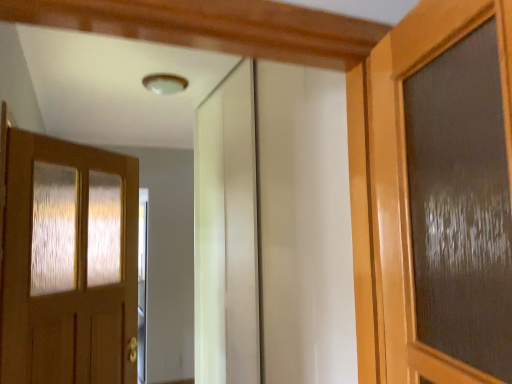
Describe the element at coordinates (69, 263) in the screenshot. I see `matte wood door at left` at that location.

Where is `matte wood door at left`? This screenshot has width=512, height=384. matte wood door at left is located at coordinates (69, 263).

Identify the location of white glossy elevator at center. The width and height of the screenshot is (512, 384). (273, 229).

Describe the element at coordinates (273, 229) in the screenshot. I see `white glossy elevator at center` at that location.

What are the coordinates of `matte wood door at left` in the screenshot? It's located at (69, 263).

Considering the relative positions of matte wood door at left and white glossy elevator at center in the image provided, is matte wood door at left to the left of white glossy elevator at center from the viewer's perspective?

Yes, matte wood door at left is to the left of white glossy elevator at center.

Is matte wood door at left closer to camera compared to white glossy elevator at center?

No, matte wood door at left is behind white glossy elevator at center.

Does point (75, 355) lie behind point (201, 275)?

No, it is not.

From the image's perspective, is matte wood door at left located beneath white glossy elevator at center?

Correct, matte wood door at left appears lower than white glossy elevator at center in the image.

From a real-world perspective, is matte wood door at left beneath white glossy elevator at center?

Yes, from a real-world perspective, matte wood door at left is below white glossy elevator at center.

Between matte wood door at left and white glossy elevator at center, which one has larger width?

white glossy elevator at center is wider.

Considering the sizes of objects matte wood door at left and white glossy elevator at center in the image provided, who is shorter, matte wood door at left or white glossy elevator at center?

Standing shorter between the two is matte wood door at left.

Considering the relative sizes of matte wood door at left and white glossy elevator at center in the image provided, is matte wood door at left bigger than white glossy elevator at center?

No.

Is matte wood door at left inside or outside of white glossy elevator at center?

matte wood door at left is located beyond the bounds of white glossy elevator at center.

Is matte wood door at left next to white glossy elevator at center and touching it?

No, matte wood door at left is not making contact with white glossy elevator at center.

Is matte wood door at left positioned with its back to white glossy elevator at center?

That's not correct — matte wood door at left is not looking away from white glossy elevator at center.

You are a GUI agent. You are given a task and a screenshot of the screen. Output one action in this format:
    pyautogui.click(x=<x>, y=<y>)
    Task: Click on the elevator above the matte wood door at left (from the image's perspective)
    This screenshot has width=512, height=384.
    Given the screenshot: What is the action you would take?
    pyautogui.click(x=273, y=229)

Considering the relative positions of white glossy elevator at center and matte wood door at left in the image provided, is white glossy elevator at center to the right of matte wood door at left from the viewer's perspective?

Yes, white glossy elevator at center is to the right of matte wood door at left.

Relative to matte wood door at left, is white glossy elevator at center in front or behind?

In the image, white glossy elevator at center appears in front of matte wood door at left.

Considering the positions of point (286, 143) and point (130, 176), is point (286, 143) closer or farther from the camera than point (130, 176)?

Point (286, 143) is closer to the camera than point (130, 176).

From the image's perspective, is white glossy elevator at center located above or below matte wood door at left?

Clearly, from the image's perspective, white glossy elevator at center is above matte wood door at left.

From a real-world perspective, is white glossy elevator at center positioned over matte wood door at left based on gravity?

Yes, from a real-world perspective, white glossy elevator at center is over matte wood door at left

Looking at their sizes, would you say white glossy elevator at center is wider or thinner than matte wood door at left?

A: Clearly, white glossy elevator at center has more width compared to matte wood door at left.

Between white glossy elevator at center and matte wood door at left, which one has more height?

With more height is white glossy elevator at center.

Considering the sizes of white glossy elevator at center and matte wood door at left in the image, is white glossy elevator at center bigger or smaller than matte wood door at left?

white glossy elevator at center is bigger than matte wood door at left.

Which is correct: white glossy elevator at center is inside matte wood door at left, or outside of it?

white glossy elevator at center is located beyond the bounds of matte wood door at left.

Would you say white glossy elevator at center is a long distance from matte wood door at left?

white glossy elevator at center is actually quite close to matte wood door at left.

Is matte wood door at left at the back of white glossy elevator at center?

No.

From the picture: How distant is white glossy elevator at center from matte wood door at left?

white glossy elevator at center and matte wood door at left are 30.22 inches apart from each other.

You are a GUI agent. You are given a task and a screenshot of the screen. Output one action in this format:
    pyautogui.click(x=<x>, y=<y>)
    Task: Click on the elevator above the matte wood door at left (from the image's perspective)
    
    Given the screenshot: What is the action you would take?
    pyautogui.click(x=273, y=229)

This screenshot has height=384, width=512. Find the location of `elevator lying on the right of matte wood door at left`. elevator lying on the right of matte wood door at left is located at coordinates (273, 229).

Find the location of a particular element. The image size is (512, 384). door lying below the white glossy elevator at center (from the image's perspective) is located at coordinates (69, 263).